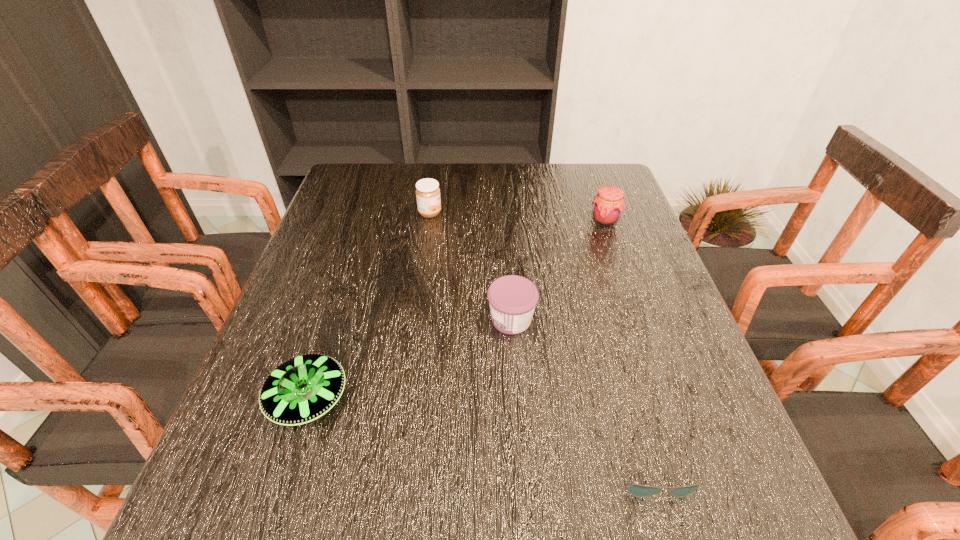
This screenshot has height=540, width=960. I want to click on vacant space that's between the leftmost jam and the second jam from left to right, so click(x=470, y=266).

Identify the location of vacant area that lies between the rightmost jam and the third object from right to left. (558, 270).

Identify the location of free space between the rightmost jam and the sunglasses. The height and width of the screenshot is (540, 960). (628, 343).

Where is `free spot between the third nearest object and the rightmost jam`? The image size is (960, 540). free spot between the third nearest object and the rightmost jam is located at coordinates (558, 270).

Locate an element on the screen. the fourth closest object to the saucer is located at coordinates (608, 204).

This screenshot has width=960, height=540. Identify the location of the second closest object to the second object from left to right. (608, 204).

Locate which jam is the second closest to the rightmost jam. Please provide its 2D coordinates. Your answer should be formatted as a tuple, i.e. [(x, y)], where the tuple contains the x and y coordinates of a point satisfying the conditions above.

[(427, 191)]

Select which jam is the third closest to the shortest object. Please provide its 2D coordinates. Your answer should be formatted as a tuple, i.e. [(x, y)], where the tuple contains the x and y coordinates of a point satisfying the conditions above.

[(427, 191)]

Locate an element on the screen. This screenshot has width=960, height=540. free point that satisfies the following two spatial constraints: 1. on the front label of the fourth object from right to left; 2. on the right side of the rightmost jam is located at coordinates [429, 220].